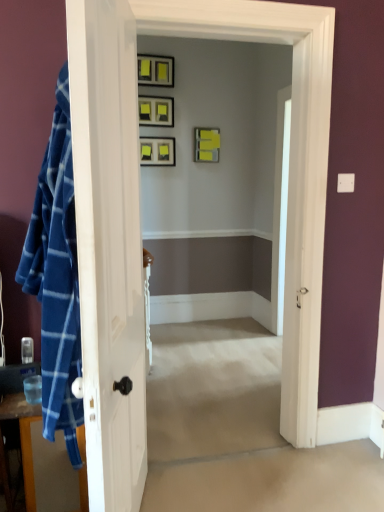
Describe the element at coordinates (155, 70) in the screenshot. The width and height of the screenshot is (384, 512). I see `matte black picture frame at upper center, which appears as the first picture frame when viewed from the top` at that location.

I want to click on blue plaid fabric at left, so click(23, 438).

Measure the distance between blue plaid fabric at left and camera.

blue plaid fabric at left is 5.18 feet away from camera.

This screenshot has height=512, width=384. What do you see at coordinates (206, 145) in the screenshot?
I see `yellow matte picture frame at upper center, the second picture frame from the bottom` at bounding box center [206, 145].

Where is `matte black picture frame at upper center, marked as the 4th picture frame in a bottom-to-top arrangement`? This screenshot has height=512, width=384. matte black picture frame at upper center, marked as the 4th picture frame in a bottom-to-top arrangement is located at coordinates (155, 70).

Would you say blue plaid fabric at left is a long distance from matte black picture frame at upper center, arranged as the second picture frame when viewed from the top?

blue plaid fabric at left is far away from matte black picture frame at upper center, arranged as the second picture frame when viewed from the top.

Between blue plaid fabric at left and matte black picture frame at upper center, the third picture frame positioned from the bottom, which one has more height?

With more height is blue plaid fabric at left.

From the image's perspective, which is above, blue plaid fabric at left or matte black picture frame at upper center, the third picture frame positioned from the bottom?

matte black picture frame at upper center, the third picture frame positioned from the bottom.

Is yellow matte picture frame at upper center, the second picture frame from the bottom, located within matte black picture frame at center, the first picture frame when ordered from bottom to top?

No, yellow matte picture frame at upper center, the second picture frame from the bottom, is not surrounded by matte black picture frame at center, the first picture frame when ordered from bottom to top.

Is matte black picture frame at center, marked as the 4th picture frame in a top-to-bottom arrangement, bigger than yellow matte picture frame at upper center, the 3th picture frame in the top-to-bottom sequence?

Incorrect, matte black picture frame at center, marked as the 4th picture frame in a top-to-bottom arrangement, is not larger than yellow matte picture frame at upper center, the 3th picture frame in the top-to-bottom sequence.

From a real-world perspective, does matte black picture frame at center, the first picture frame when ordered from bottom to top, sit lower than yellow matte picture frame at upper center, the second picture frame from the bottom?

Yes.

Between matte black picture frame at center, the first picture frame when ordered from bottom to top, and yellow matte picture frame at upper center, the 3th picture frame in the top-to-bottom sequence, which one appears on the right side from the viewer's perspective?

yellow matte picture frame at upper center, the 3th picture frame in the top-to-bottom sequence, is more to the right.

Find the location of `picture frame that is the 3rd one when counting rightward from the matte black picture frame at upper center, the third picture frame positioned from the bottom`. picture frame that is the 3rd one when counting rightward from the matte black picture frame at upper center, the third picture frame positioned from the bottom is located at coordinates (206, 145).

Is yellow matte picture frame at upper center, the second picture frame from the bottom, inside the boundaries of matte black picture frame at upper center, arranged as the second picture frame when viewed from the top, or outside?

yellow matte picture frame at upper center, the second picture frame from the bottom, lies outside matte black picture frame at upper center, arranged as the second picture frame when viewed from the top.

Is yellow matte picture frame at upper center, the 3th picture frame in the top-to-bottom sequence, positioned before matte black picture frame at upper center, arranged as the second picture frame when viewed from the top?

No, yellow matte picture frame at upper center, the 3th picture frame in the top-to-bottom sequence, is further to the viewer.

Is yellow matte picture frame at upper center, the second picture frame from the bottom, taller or shorter than matte black picture frame at upper center, arranged as the second picture frame when viewed from the top?

Considering their sizes, yellow matte picture frame at upper center, the second picture frame from the bottom, has more height than matte black picture frame at upper center, arranged as the second picture frame when viewed from the top.

In the scene shown: Is matte black picture frame at upper center, marked as the 4th picture frame in a bottom-to-top arrangement, directly adjacent to matte black picture frame at center, marked as the 4th picture frame in a top-to-bottom arrangement?

They are not placed beside each other.

Which object is closer to the camera taking this photo, matte black picture frame at upper center, marked as the 4th picture frame in a bottom-to-top arrangement, or matte black picture frame at center, marked as the 4th picture frame in a top-to-bottom arrangement?

Positioned in front is matte black picture frame at upper center, marked as the 4th picture frame in a bottom-to-top arrangement.

How many degrees apart are the facing directions of matte black picture frame at upper center, marked as the 4th picture frame in a bottom-to-top arrangement, and matte black picture frame at center, marked as the 4th picture frame in a top-to-bottom arrangement?

matte black picture frame at upper center, marked as the 4th picture frame in a bottom-to-top arrangement, and matte black picture frame at center, marked as the 4th picture frame in a top-to-bottom arrangement, are facing 0.0037 degrees away from each other.

Is matte black picture frame at upper center, marked as the 4th picture frame in a bottom-to-top arrangement, positioned with its back to matte black picture frame at center, the first picture frame when ordered from bottom to top?

No.

This screenshot has width=384, height=512. I want to click on the 2nd picture frame below the matte black picture frame at upper center, the third picture frame positioned from the bottom (from a real-world perspective), so click(157, 151).

Is matte black picture frame at upper center, the third picture frame positioned from the bottom, shorter than matte black picture frame at center, the first picture frame when ordered from bottom to top?

Correct, matte black picture frame at upper center, the third picture frame positioned from the bottom, is not as tall as matte black picture frame at center, the first picture frame when ordered from bottom to top.

Can we say matte black picture frame at upper center, the third picture frame positioned from the bottom, lies outside matte black picture frame at center, the first picture frame when ordered from bottom to top?

Absolutely, matte black picture frame at upper center, the third picture frame positioned from the bottom, is external to matte black picture frame at center, the first picture frame when ordered from bottom to top.

Does matte black picture frame at upper center, arranged as the second picture frame when viewed from the top, have a larger size compared to matte black picture frame at center, marked as the 4th picture frame in a top-to-bottom arrangement?

Actually, matte black picture frame at upper center, arranged as the second picture frame when viewed from the top, might be smaller than matte black picture frame at center, marked as the 4th picture frame in a top-to-bottom arrangement.

How many degrees apart are the facing directions of yellow matte picture frame at upper center, the second picture frame from the bottom, and matte black picture frame at upper center, marked as the 4th picture frame in a bottom-to-top arrangement?

They differ by 0.0038 degrees in their facing directions.

Is yellow matte picture frame at upper center, the second picture frame from the bottom, oriented towards matte black picture frame at upper center, which appears as the first picture frame when viewed from the top?

No, yellow matte picture frame at upper center, the second picture frame from the bottom, is not facing towards matte black picture frame at upper center, which appears as the first picture frame when viewed from the top.

Based on the photo, which is behind, yellow matte picture frame at upper center, the 3th picture frame in the top-to-bottom sequence, or matte black picture frame at upper center, marked as the 4th picture frame in a bottom-to-top arrangement?

yellow matte picture frame at upper center, the 3th picture frame in the top-to-bottom sequence, is more distant.

From the picture: Is yellow matte picture frame at upper center, the second picture frame from the bottom, smaller than matte black picture frame at upper center, marked as the 4th picture frame in a bottom-to-top arrangement?

Correct, yellow matte picture frame at upper center, the second picture frame from the bottom, occupies less space than matte black picture frame at upper center, marked as the 4th picture frame in a bottom-to-top arrangement.

Considering the relative sizes of blue plaid fabric at left and matte black picture frame at upper center, which appears as the first picture frame when viewed from the top, in the image provided, is blue plaid fabric at left wider than matte black picture frame at upper center, which appears as the first picture frame when viewed from the top,?

Indeed, blue plaid fabric at left has a greater width compared to matte black picture frame at upper center, which appears as the first picture frame when viewed from the top.

Is blue plaid fabric at left positioned before matte black picture frame at upper center, which appears as the first picture frame when viewed from the top?

That is True.

Can you confirm if blue plaid fabric at left is positioned to the left of matte black picture frame at upper center, marked as the 4th picture frame in a bottom-to-top arrangement?

Yes, blue plaid fabric at left is to the left of matte black picture frame at upper center, marked as the 4th picture frame in a bottom-to-top arrangement.

From a real-world perspective, is blue plaid fabric at left physically below matte black picture frame at upper center, marked as the 4th picture frame in a bottom-to-top arrangement?

Indeed, from a real-world perspective, blue plaid fabric at left is positioned beneath matte black picture frame at upper center, marked as the 4th picture frame in a bottom-to-top arrangement.

Locate an element on the screen. The image size is (384, 512). dresser in front of the matte black picture frame at upper center, the third picture frame positioned from the bottom is located at coordinates (23, 438).

This screenshot has height=512, width=384. In the image, there is a yellow matte picture frame at upper center, the 3th picture frame in the top-to-bottom sequence. Find the location of `picture frame below it (from a real-world perspective)`. picture frame below it (from a real-world perspective) is located at coordinates (157, 151).

When comparing their distances from matte black picture frame at upper center, arranged as the second picture frame when viewed from the top, does matte black picture frame at center, marked as the 4th picture frame in a top-to-bottom arrangement, or blue plaid fabric at left seem further?

Among the two, blue plaid fabric at left is located further to matte black picture frame at upper center, arranged as the second picture frame when viewed from the top.

Estimate the real-world distances between objects in this image. Which object is closer to matte black picture frame at center, marked as the 4th picture frame in a top-to-bottom arrangement, yellow matte picture frame at upper center, the second picture frame from the bottom, or matte black picture frame at upper center, marked as the 4th picture frame in a bottom-to-top arrangement?

The object closer to matte black picture frame at center, marked as the 4th picture frame in a top-to-bottom arrangement, is yellow matte picture frame at upper center, the second picture frame from the bottom.

Looking at the image, which one is located further to matte black picture frame at center, the first picture frame when ordered from bottom to top, matte black picture frame at upper center, marked as the 4th picture frame in a bottom-to-top arrangement, or yellow matte picture frame at upper center, the second picture frame from the bottom?

matte black picture frame at upper center, marked as the 4th picture frame in a bottom-to-top arrangement.

Which object lies nearer to the anchor point matte black picture frame at upper center, the third picture frame positioned from the bottom, blue plaid fabric at left or matte black picture frame at upper center, which appears as the first picture frame when viewed from the top?

matte black picture frame at upper center, which appears as the first picture frame when viewed from the top, lies closer to matte black picture frame at upper center, the third picture frame positioned from the bottom, than the other object.

When comparing their distances from matte black picture frame at upper center, which appears as the first picture frame when viewed from the top, does blue plaid fabric at left or yellow matte picture frame at upper center, the second picture frame from the bottom, seem closer?

yellow matte picture frame at upper center, the second picture frame from the bottom.

Based on their spatial positions, is matte black picture frame at upper center, marked as the 4th picture frame in a bottom-to-top arrangement, or blue plaid fabric at left further from matte black picture frame at center, marked as the 4th picture frame in a top-to-bottom arrangement?

Based on the image, blue plaid fabric at left appears to be further to matte black picture frame at center, marked as the 4th picture frame in a top-to-bottom arrangement.

Based on their spatial positions, is matte black picture frame at center, marked as the 4th picture frame in a top-to-bottom arrangement, or yellow matte picture frame at upper center, the 3th picture frame in the top-to-bottom sequence, further from matte black picture frame at upper center, which appears as the first picture frame when viewed from the top?

yellow matte picture frame at upper center, the 3th picture frame in the top-to-bottom sequence, lies further to matte black picture frame at upper center, which appears as the first picture frame when viewed from the top, than the other object.

When comparing their distances from matte black picture frame at center, marked as the 4th picture frame in a top-to-bottom arrangement, does yellow matte picture frame at upper center, the 3th picture frame in the top-to-bottom sequence, or blue plaid fabric at left seem closer?

yellow matte picture frame at upper center, the 3th picture frame in the top-to-bottom sequence, is closer to matte black picture frame at center, marked as the 4th picture frame in a top-to-bottom arrangement.

The image size is (384, 512). I want to click on picture frame between matte black picture frame at upper center, marked as the 4th picture frame in a bottom-to-top arrangement, and yellow matte picture frame at upper center, the second picture frame from the bottom, in the vertical direction, so click(156, 111).